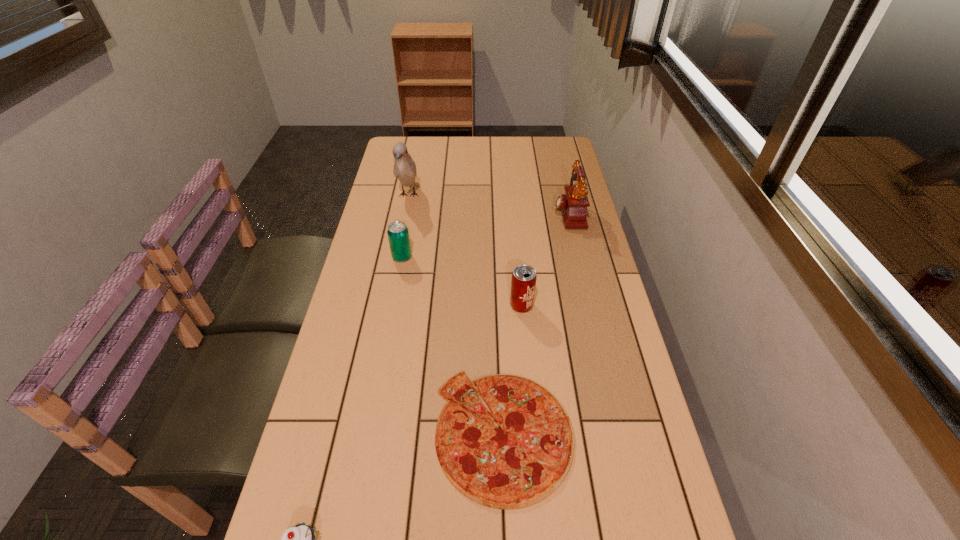
At what (x,y) coordinates should I click in order to perform the action: click on bird. Please return your answer as a coordinate pair (x, y). Looking at the image, I should click on (404, 169).

The width and height of the screenshot is (960, 540). Identify the location of the rightmost object. (573, 204).

Identify the location of telephone. (573, 204).

Image resolution: width=960 pixels, height=540 pixels. Find the location of `the nearer beer can`. the nearer beer can is located at coordinates (523, 282).

At what (x,y) coordinates should I click in order to perform the action: click on the fourth farthest object. Please return your answer as a coordinate pair (x, y). The width and height of the screenshot is (960, 540). Looking at the image, I should click on (523, 282).

You are a GUI agent. You are given a task and a screenshot of the screen. Output one action in this format:
    pyautogui.click(x=<x>, y=<y>)
    Task: Click on the left beer can
    This screenshot has height=540, width=960.
    Given the screenshot: What is the action you would take?
    pyautogui.click(x=398, y=235)

You are a GUI agent. You are given a task and a screenshot of the screen. Output one action in this format:
    pyautogui.click(x=<x>, y=<y>)
    Task: Click on the farther beer can
    The image size is (960, 540).
    Given the screenshot: What is the action you would take?
    pyautogui.click(x=398, y=235)

Find the location of `pizza`. pizza is located at coordinates (521, 464).

This screenshot has width=960, height=540. I want to click on the shortest object, so [x=521, y=464].

Where is `vacant space situated 0.350m at the beak of the bird`? The height and width of the screenshot is (540, 960). vacant space situated 0.350m at the beak of the bird is located at coordinates (391, 284).